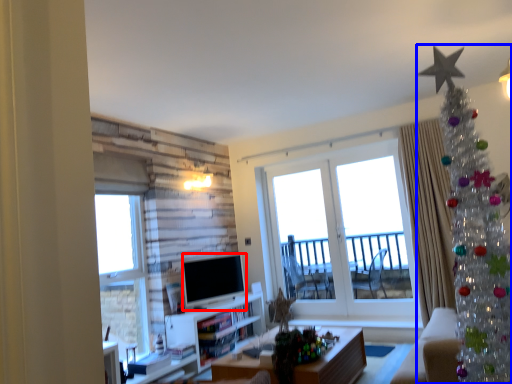
Question: Which point is further to the camera, television (highlighted by a red box) or christmas tree (highlighted by a blue box)?

Choices:
 (A) television
 (B) christmas tree

Answer: (A)